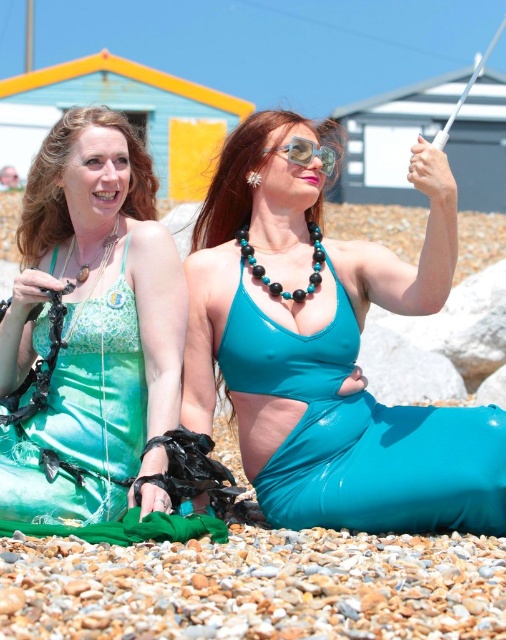
Question: Does matte green mermaid suit at left appear over turquoise/black beaded necklace at center?

Choices:
 (A) yes
 (B) no

Answer: (B)

Question: Which point is farther to the camera?

Choices:
 (A) green beaded necklace at upper left
 (B) sunglasses at center
 (C) turquoise/black beaded necklace at center

Answer: (B)

Question: Which object appears farthest from the camera in this image?

Choices:
 (A) turquoise/black beaded necklace at center
 (B) matte green mermaid suit at left

Answer: (A)

Question: Does turquoise/black beaded necklace at center have a greater width compared to sunglasses at center?

Choices:
 (A) no
 (B) yes

Answer: (B)

Question: Which is farther from the turquoise/black beaded necklace at center?

Choices:
 (A) teal glossy mermaid costume at center
 (B) green beaded necklace at upper left
 (C) matte green mermaid suit at left

Answer: (C)

Question: Is matte green mermaid suit at left above turquoise/black beaded necklace at center?

Choices:
 (A) no
 (B) yes

Answer: (A)